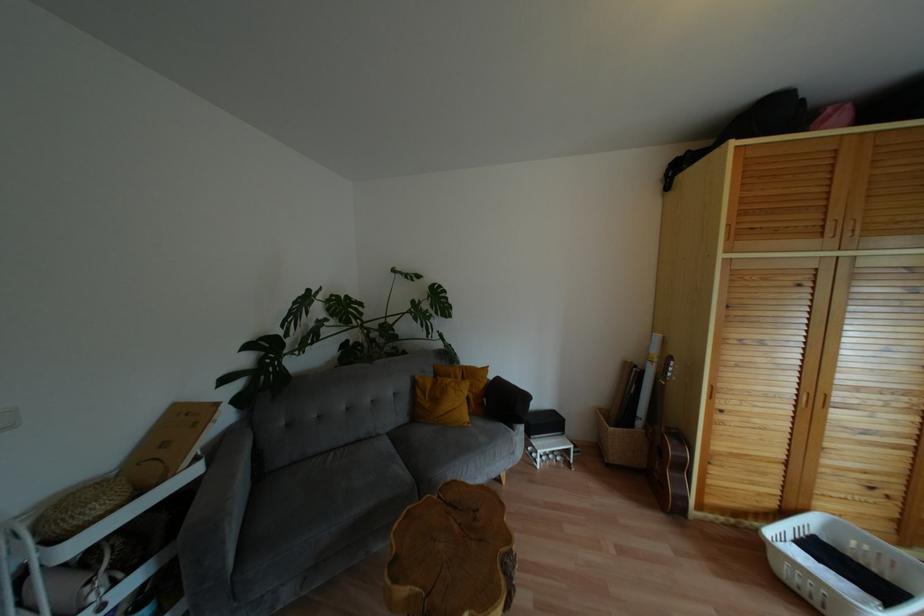
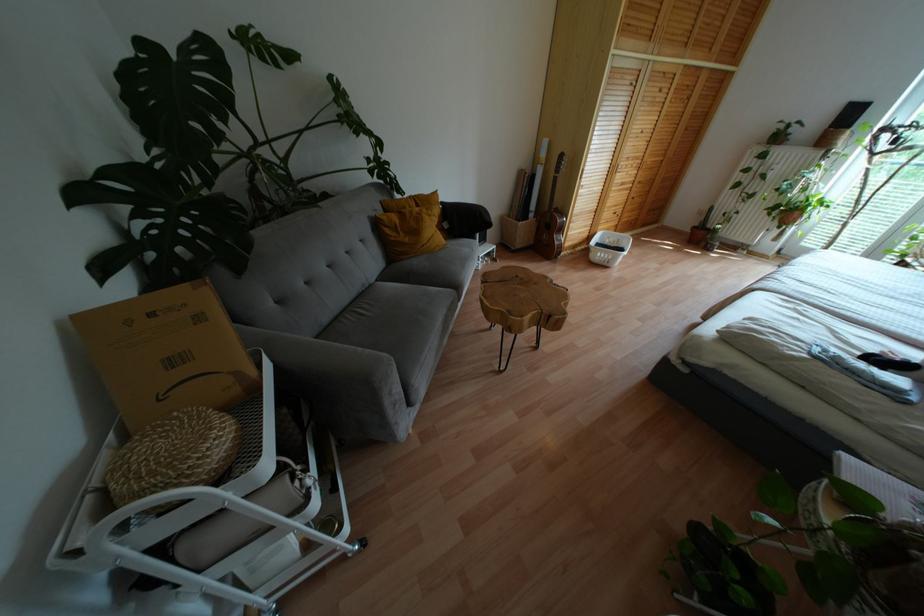
Find the pixel in the second image that matches pixel 484 369 in the first image.

(434, 193)